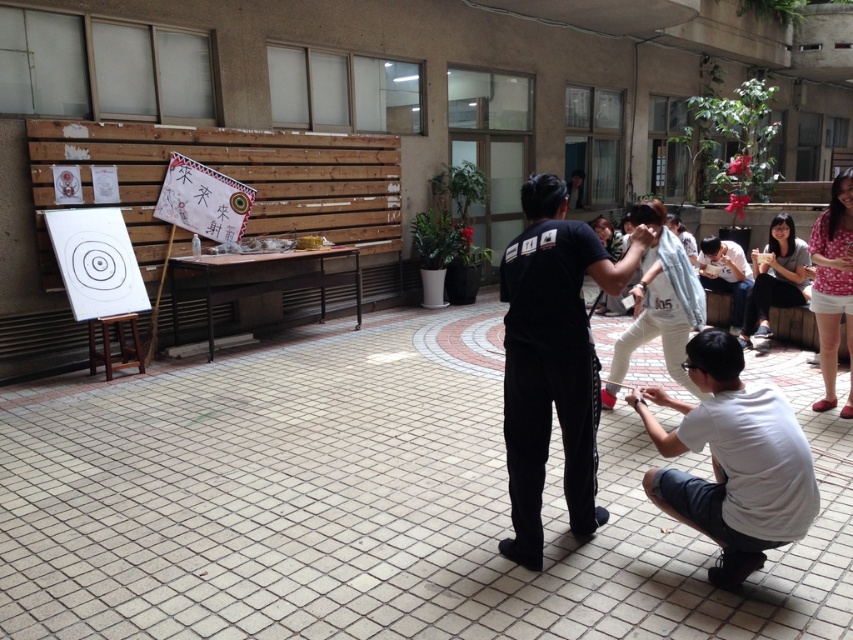
Is white matte shirt at lower right shorter than white cotton shirt at lower right?

Incorrect, white matte shirt at lower right's height does not fall short of white cotton shirt at lower right's.

Where is `white matte shirt at lower right`? white matte shirt at lower right is located at coordinates (732, 460).

The height and width of the screenshot is (640, 853). What do you see at coordinates (552, 360) in the screenshot? I see `black matte shirt at center` at bounding box center [552, 360].

Is point (554, 378) positioned before point (740, 262)?

Yes.

Where is `black matte shirt at center`? This screenshot has height=640, width=853. black matte shirt at center is located at coordinates (552, 360).

Can you confirm if black matte shirt at center is positioned to the right of white matte shirt at lower right?

In fact, black matte shirt at center is to the left of white matte shirt at lower right.

Identify the location of black matte shirt at center. This screenshot has width=853, height=640. [552, 360].

Between point (648, 244) and point (799, 512), which one is positioned behind?

Positioned behind is point (648, 244).

This screenshot has height=640, width=853. I want to click on black matte shirt at center, so pyautogui.click(x=552, y=360).